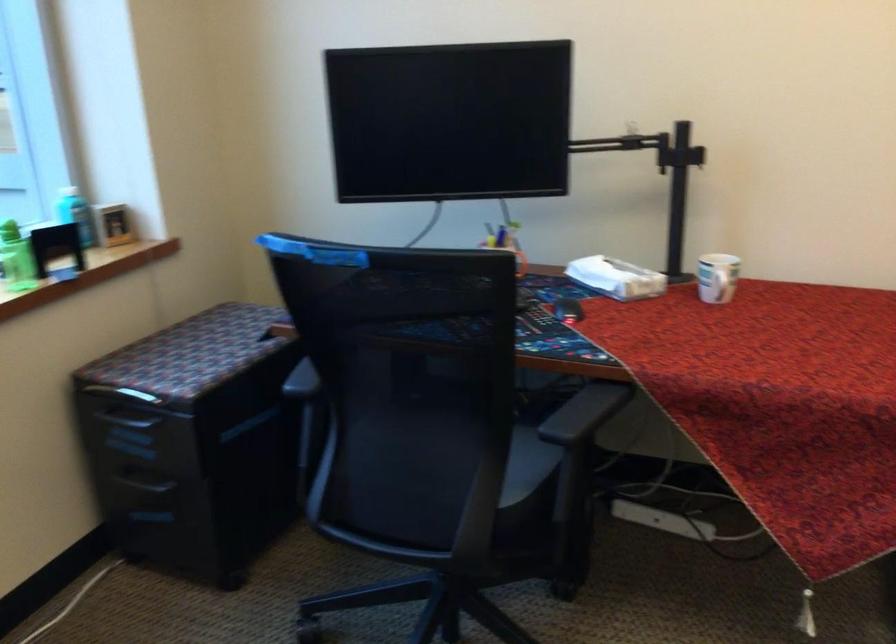
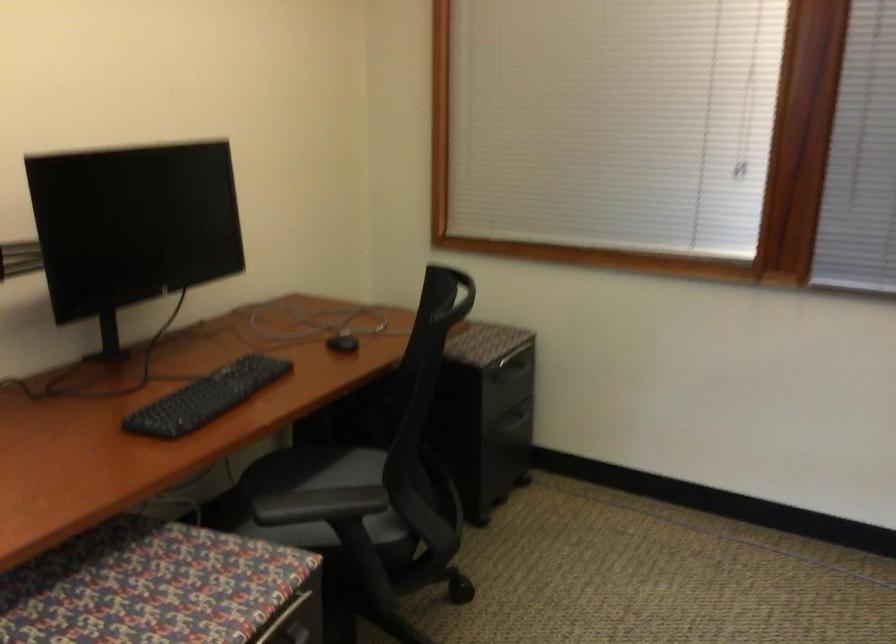
Question: The camera is either moving clockwise (left) or counter-clockwise (right) around the object. The first image is from the beginning of the video and the second image is from the end. Is the camera moving left or right when shooting the video?

Choices:
 (A) Left
 (B) Right

Answer: (A)